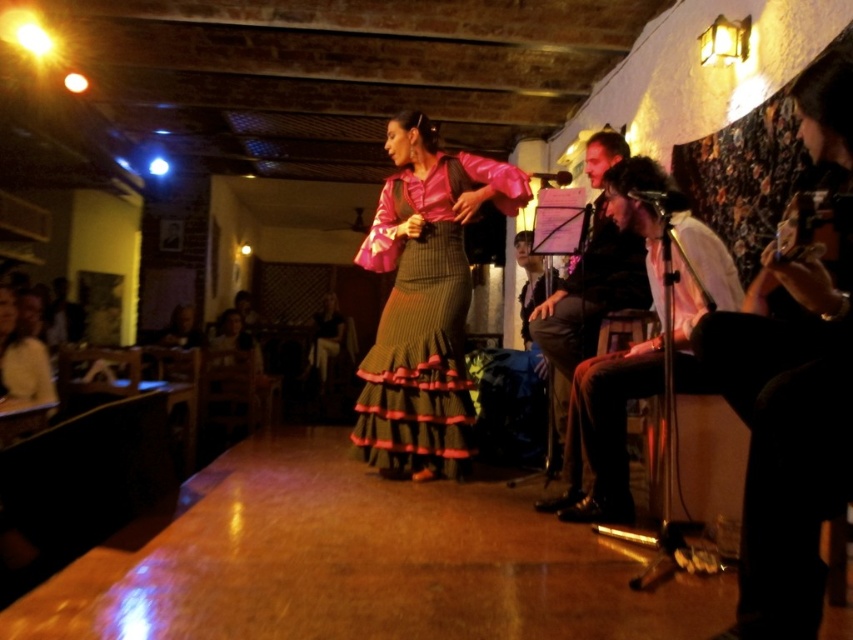
Which is below, shiny black guitar at right or dark brown leather jacket at upper right?

Positioned lower is shiny black guitar at right.

Looking at this image, between shiny black guitar at right and dark brown leather jacket at upper right, which one appears on the left side from the viewer's perspective?

Positioned to the left is dark brown leather jacket at upper right.

Which is behind, point (799, 628) or point (611, 291)?

The point (611, 291) is behind.

Find the location of a particular element. This screenshot has width=853, height=640. shiny black guitar at right is located at coordinates (793, 385).

Does pink satin dress at center have a greater height compared to white shirt at right?

Correct, pink satin dress at center is much taller as white shirt at right.

Between point (397, 198) and point (686, 304), which one is positioned in front?

Point (686, 304)

Find the location of a particular element. pink satin dress at center is located at coordinates (424, 317).

From the picture: Does pink satin dress at center have a smaller size compared to smooth black jacket at center?

Actually, pink satin dress at center might be larger than smooth black jacket at center.

Between point (456, 385) and point (529, 240), which one is positioned behind?

Positioned behind is point (529, 240).

Describe the element at coordinates (424, 317) in the screenshot. I see `pink satin dress at center` at that location.

You are a GUI agent. You are given a task and a screenshot of the screen. Output one action in this format:
    pyautogui.click(x=<x>, y=<y>)
    Task: Click on the pink satin dress at center
    Image resolution: width=853 pixels, height=640 pixels.
    Given the screenshot: What is the action you would take?
    pyautogui.click(x=424, y=317)